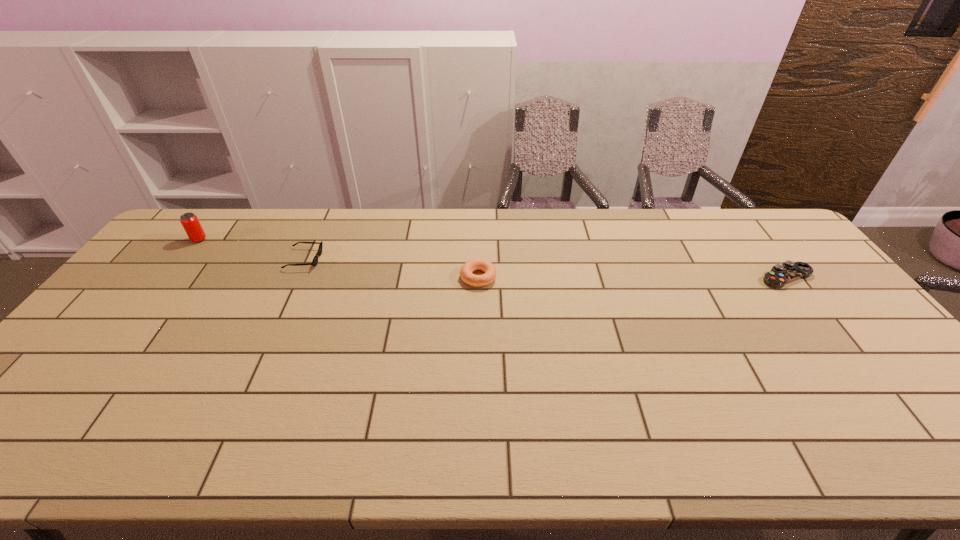
Where is `can located at the far edge`? This screenshot has height=540, width=960. can located at the far edge is located at coordinates (189, 221).

Identify the location of sunglasses that is positioned at the far edge. (315, 260).

Image resolution: width=960 pixels, height=540 pixels. I want to click on object present at the left edge, so click(x=189, y=221).

You are a GUI agent. You are given a task and a screenshot of the screen. Output one action in this format:
    pyautogui.click(x=<x>, y=<y>)
    Task: Click on the object that is at the right edge
    Image resolution: width=960 pixels, height=540 pixels.
    Given the screenshot: What is the action you would take?
    pyautogui.click(x=779, y=275)

Image resolution: width=960 pixels, height=540 pixels. Identify the location of object situated at the far left corner. (189, 221).

At what (x,y) coordinates should I click in order to perform the action: click on vacant space at the far edge of the desktop. Please return your answer as a coordinate pair (x, y). This screenshot has width=960, height=540. Looking at the image, I should click on (283, 213).

This screenshot has width=960, height=540. In order to click on blank space at the near edge of the desktop in this screenshot , I will do `click(466, 463)`.

This screenshot has height=540, width=960. What are the coordinates of `vacant space at the left edge` in the screenshot? It's located at (177, 275).

Locate an element on the screen. The image size is (960, 540). vacant space at the right edge of the desktop is located at coordinates (872, 334).

At what (x,y) coordinates should I click in order to perform the action: click on free spot at the far right corner of the desktop. Please return your answer as a coordinate pair (x, y). Looking at the image, I should click on (746, 239).